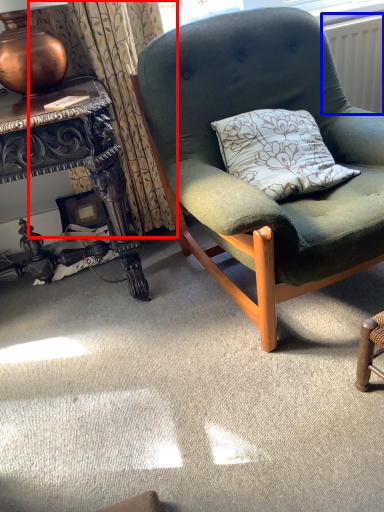
Question: Which of the following is the closest to the observer, curtain (highlighted by a red box) or radiator (highlighted by a blue box)?

Choices:
 (A) curtain
 (B) radiator

Answer: (A)